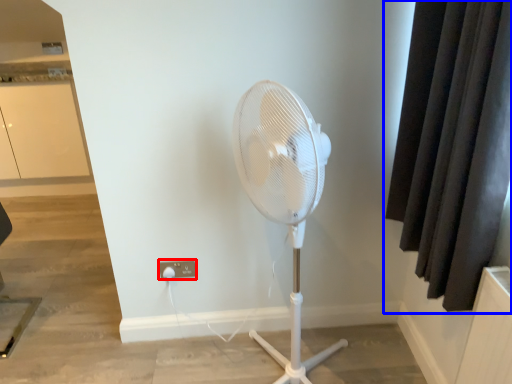
Question: Which object appears closest to the camera in this image, electric outlet (highlighted by a red box) or curtain (highlighted by a blue box)?

Choices:
 (A) electric outlet
 (B) curtain

Answer: (B)